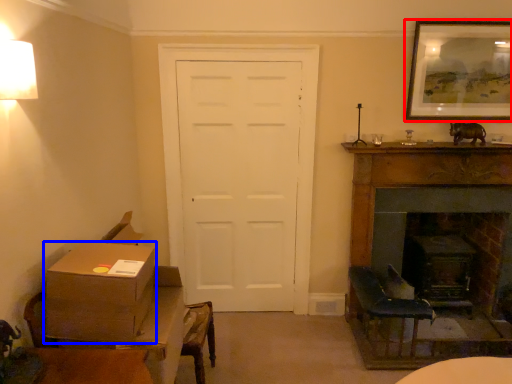
Question: Which object appears closest to the camera in this image, picture frame (highlighted by a red box) or box (highlighted by a blue box)?

Choices:
 (A) picture frame
 (B) box

Answer: (B)